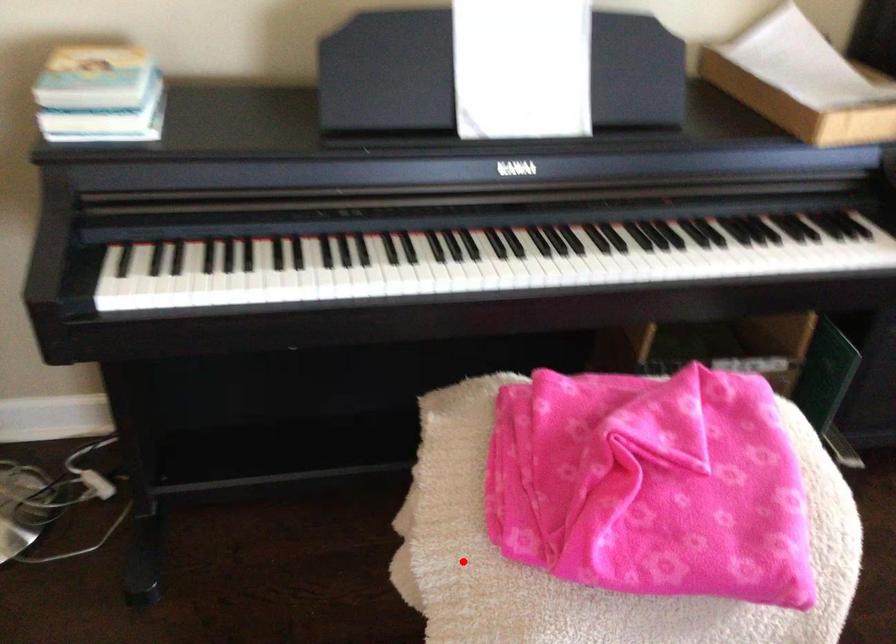
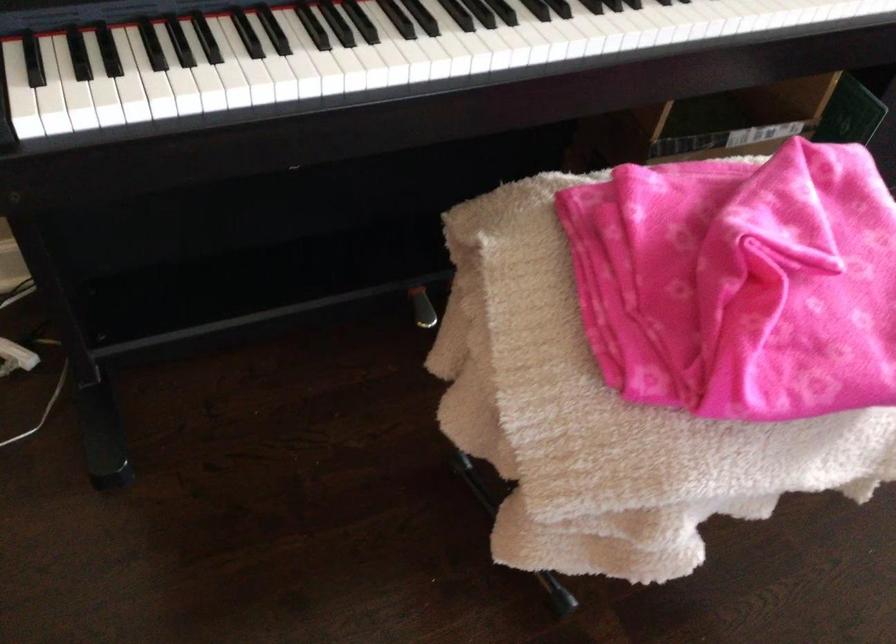
Question: I am providing you with two images of the same scene from different viewpoints. A red point is shown in image1. For the corresponding object point in image2, is it positioned nearer or farther from the camera?

Choices:
 (A) Nearer
 (B) Farther

Answer: (A)